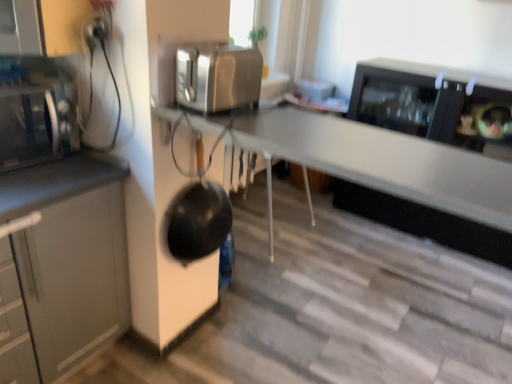
Measure the distance between satin silver toaster at upper center and camera.

satin silver toaster at upper center is 1.22 meters away from camera.

Locate an element on the screen. Image resolution: width=512 pixels, height=384 pixels. matte black microwave at left is located at coordinates (36, 111).

At what (x,y) coordinates should I click in order to perform the action: click on satin silver toaster at upper center. Please return your answer as a coordinate pair (x, y). The height and width of the screenshot is (384, 512). Looking at the image, I should click on (218, 77).

Who is taller, black matte wok at center or matte black microwave at left?

Standing taller between the two is black matte wok at center.

From the image's perspective, is black matte wok at center below matte black microwave at left?

Correct, black matte wok at center appears lower than matte black microwave at left in the image.

Could you tell me if black matte wok at center is turned towards matte black microwave at left?

No, black matte wok at center is not oriented towards matte black microwave at left.

Where is `kitchen appliance above the black matte wok at center (from a real-world perspective)`? kitchen appliance above the black matte wok at center (from a real-world perspective) is located at coordinates (218, 77).

Which is more to the right, satin silver toaster at upper center or black matte wok at center?

satin silver toaster at upper center.

Is satin silver toaster at upper center in front of or behind black matte wok at center in the image?

Visually, satin silver toaster at upper center is located in front of black matte wok at center.

Which of these two, black matte wok at center or satin silver toaster at upper center, is wider?

With larger width is satin silver toaster at upper center.

Where is `kitchen appliance above the black matte wok at center (from the image's perspective)`? kitchen appliance above the black matte wok at center (from the image's perspective) is located at coordinates (218, 77).

Would you say black matte wok at center is to the left or to the right of satin silver toaster at upper center in the picture?

Clearly, black matte wok at center is on the left of satin silver toaster at upper center in the image.

What's the angular difference between black matte wok at center and satin silver toaster at upper center's facing directions?

black matte wok at center and satin silver toaster at upper center are facing 0.88 degrees away from each other.

Considering the relative sizes of matte black microwave at left and black matte wok at center in the image provided, is matte black microwave at left taller than black matte wok at center?

No.

From the image's perspective, would you say matte black microwave at left is shown under black matte wok at center?

Incorrect, from the image's perspective, matte black microwave at left is higher than black matte wok at center.

Which is in front, matte black microwave at left or black matte wok at center?

matte black microwave at left is more forward.

Is point (4, 111) positioned before point (174, 200)?

That is True.

Which object is wider, satin silver toaster at upper center or matte black microwave at left?

matte black microwave at left.

Is satin silver toaster at upper center surrounding matte black microwave at left?

No, matte black microwave at left is located outside of satin silver toaster at upper center.

Does satin silver toaster at upper center lie behind matte black microwave at left?

No, it is not.

How many degrees apart are the facing directions of satin silver toaster at upper center and matte black microwave at left?

The angular difference between satin silver toaster at upper center and matte black microwave at left is 8.75 degrees.

From a real-world perspective, is matte black microwave at left physically below satin silver toaster at upper center?

Yes, from a real-world perspective, matte black microwave at left is below satin silver toaster at upper center.

In terms of height, does matte black microwave at left look taller or shorter compared to satin silver toaster at upper center?

Considering their sizes, matte black microwave at left has more height than satin silver toaster at upper center.

Looking at their sizes, would you say matte black microwave at left is wider or thinner than satin silver toaster at upper center?

Considering their sizes, matte black microwave at left looks broader than satin silver toaster at upper center.

In the scene shown: Can you confirm if matte black microwave at left is smaller than satin silver toaster at upper center?

No, matte black microwave at left is not smaller than satin silver toaster at upper center.

The height and width of the screenshot is (384, 512). There is a black matte wok at center. What are the coordinates of `home appliance above it (from a real-world perspective)` in the screenshot? It's located at (36, 111).

Find the location of a particular element. The width and height of the screenshot is (512, 384). kitchen appliance lying on the right of black matte wok at center is located at coordinates (218, 77).

Estimate the real-world distances between objects in this image. Which object is further from black matte wok at center, matte black microwave at left or satin silver toaster at upper center?

Among the two, matte black microwave at left is located further to black matte wok at center.

Considering their positions, is black matte wok at center positioned further to matte black microwave at left than satin silver toaster at upper center?

Among the two, satin silver toaster at upper center is located further to matte black microwave at left.

Looking at this image, looking at the image, which one is located further to matte black microwave at left, satin silver toaster at upper center or black matte wok at center?

The object further to matte black microwave at left is satin silver toaster at upper center.

Looking at the image, which one is located closer to black matte wok at center, satin silver toaster at upper center or matte black microwave at left?

The object closer to black matte wok at center is satin silver toaster at upper center.

Which object lies nearer to the anchor point satin silver toaster at upper center, matte black microwave at left or black matte wok at center?

black matte wok at center lies closer to satin silver toaster at upper center than the other object.

Which object lies further to the anchor point satin silver toaster at upper center, black matte wok at center or matte black microwave at left?

matte black microwave at left is positioned further to the anchor satin silver toaster at upper center.

Find the location of `wok situated between matte black microwave at left and satin silver toaster at upper center from left to right`. wok situated between matte black microwave at left and satin silver toaster at upper center from left to right is located at coordinates (198, 217).